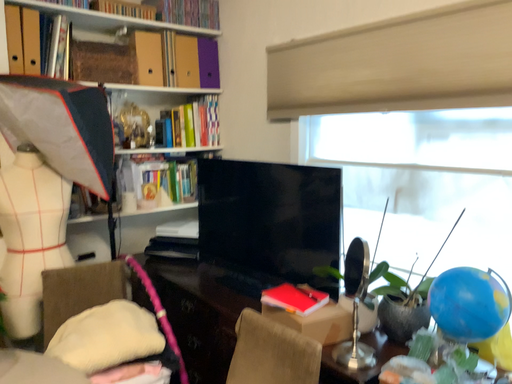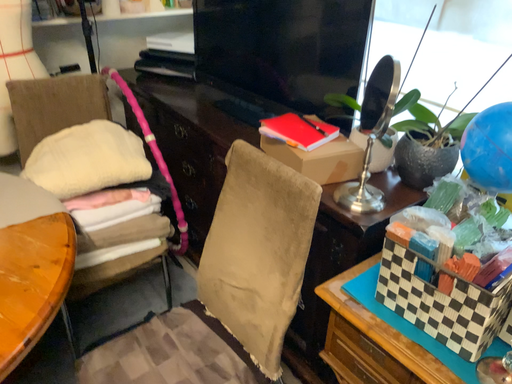
Question: Which way did the camera rotate in the video?

Choices:
 (A) rotated upward
 (B) rotated downward

Answer: (B)